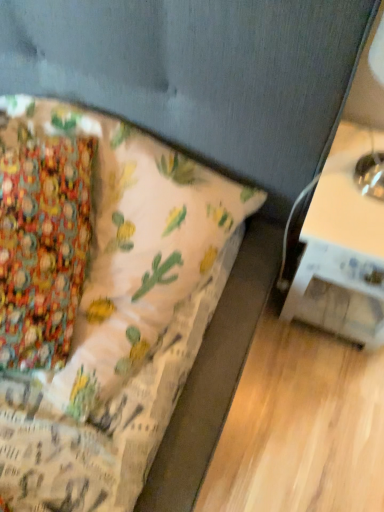
The image size is (384, 512). Describe the element at coordinates (119, 317) in the screenshot. I see `textured fabric bed at lower left` at that location.

Based on the photo, what is the approximate width of textured fabric bed at lower left?

textured fabric bed at lower left is 25.10 inches in width.

Where is `textured fabric bed at lower left`? This screenshot has height=512, width=384. textured fabric bed at lower left is located at coordinates (119, 317).

At what (x,y) coordinates should I click in order to perform the action: click on white glossy table at right. Please return your answer as a coordinate pair (x, y). The width and height of the screenshot is (384, 512). Looking at the image, I should click on (340, 252).

What do you see at coordinates (340, 252) in the screenshot? The image size is (384, 512). I see `white glossy table at right` at bounding box center [340, 252].

Where is `textured fabric bed at lower left`? This screenshot has width=384, height=512. textured fabric bed at lower left is located at coordinates (119, 317).

Between textured fabric bed at lower left and white glossy table at right, which one appears on the right side from the viewer's perspective?

Positioned to the right is white glossy table at right.

Considering their positions, is textured fabric bed at lower left located in front of or behind white glossy table at right?

In the image, textured fabric bed at lower left appears in front of white glossy table at right.

Is point (115, 485) positioned after point (349, 328)?

No.

From the image's perspective, relative to white glossy table at right, is textured fabric bed at lower left above or below?

Clearly, from the image's perspective, textured fabric bed at lower left is above white glossy table at right.

From a real-world perspective, between textured fabric bed at lower left and white glossy table at right, who is vertically higher?

From a 3D spatial view, textured fabric bed at lower left is above.

Which object is wider, textured fabric bed at lower left or white glossy table at right?

With larger width is textured fabric bed at lower left.

In terms of height, does textured fabric bed at lower left look taller or shorter compared to white glossy table at right?

Clearly, textured fabric bed at lower left is shorter compared to white glossy table at right.

Between textured fabric bed at lower left and white glossy table at right, which one has smaller size?

Smaller between the two is white glossy table at right.

Could white glossy table at right be considered to be inside textured fabric bed at lower left?

No, white glossy table at right is located outside of textured fabric bed at lower left.

Can you see textured fabric bed at lower left touching white glossy table at right?

textured fabric bed at lower left and white glossy table at right are not in contact.

Is textured fabric bed at lower left facing towards white glossy table at right?

No, textured fabric bed at lower left is not aimed at white glossy table at right.

How many degrees apart are the facing directions of textured fabric bed at lower left and white glossy table at right?

The angle between the facing direction of textured fabric bed at lower left and the facing direction of white glossy table at right is 4.2 degrees.

In the image, there is a textured fabric bed at lower left. Identify the location of table below it (from a real-world perspective). (340, 252).

Visually, is white glossy table at right positioned to the left or to the right of textured fabric bed at lower left?

Clearly, white glossy table at right is on the right of textured fabric bed at lower left in the image.

In the image, is white glossy table at right positioned in front of or behind textured fabric bed at lower left?

In the image, white glossy table at right appears behind textured fabric bed at lower left.

Which is farther from the camera, (329, 271) or (202, 320)?

Point (202, 320)

From the image's perspective, which one is positioned higher, white glossy table at right or textured fabric bed at lower left?

textured fabric bed at lower left, from the image's perspective.

Looking at this image, from a real-world perspective, which is physically above, white glossy table at right or textured fabric bed at lower left?

textured fabric bed at lower left, from a real-world perspective.

Does white glossy table at right have a greater width compared to textured fabric bed at lower left?

In fact, white glossy table at right might be narrower than textured fabric bed at lower left.

Is white glossy table at right shorter than textured fabric bed at lower left?

No.

Which of these two, white glossy table at right or textured fabric bed at lower left, is bigger?

Bigger between the two is textured fabric bed at lower left.

Could textured fabric bed at lower left be considered to be inside white glossy table at right?

No, textured fabric bed at lower left is not a part of white glossy table at right.

Is white glossy table at right not close to textured fabric bed at lower left?

white glossy table at right is actually quite close to textured fabric bed at lower left.

Does white glossy table at right turn towards textured fabric bed at lower left?

No, white glossy table at right is not turned towards textured fabric bed at lower left.

How many degrees apart are the facing directions of white glossy table at right and textured fabric bed at lower left?

The angle between the facing direction of white glossy table at right and the facing direction of textured fabric bed at lower left is 4.2 degrees.

Locate an element on the screen. bed that appears above the white glossy table at right (from a real-world perspective) is located at coordinates (119, 317).

You are a GUI agent. You are given a task and a screenshot of the screen. Output one action in this format:
    pyautogui.click(x=<x>, y=<y>)
    Task: Click on the bed above the white glossy table at right (from the image's perspective)
    The height and width of the screenshot is (512, 384).
    Given the screenshot: What is the action you would take?
    pyautogui.click(x=119, y=317)

Identify the location of bed in front of the white glossy table at right. The width and height of the screenshot is (384, 512). (119, 317).